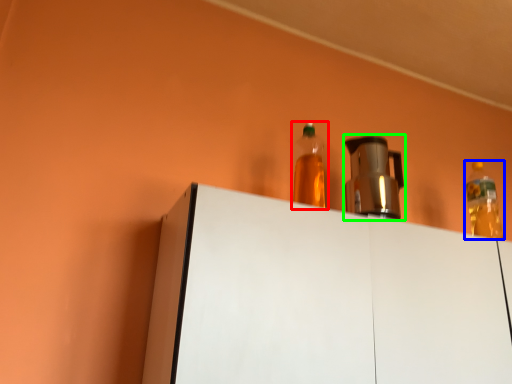
Question: Considering the real-world distances, which object is farthest from bottle (highlighted by a red box)? bottle (highlighted by a blue box) or appliance (highlighted by a green box)?

Choices:
 (A) bottle
 (B) appliance

Answer: (B)